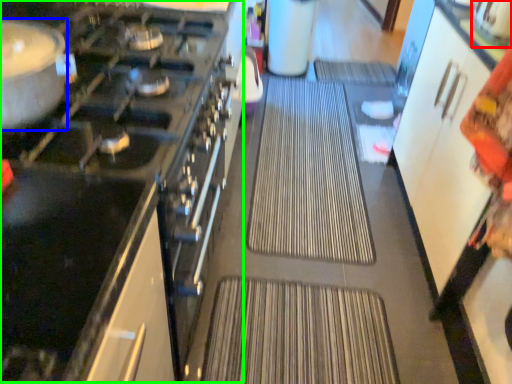
Question: Considering the real-world distances, which object is closest to appliance (highlighted by a red box)? kitchen appliance (highlighted by a blue box) or appliance (highlighted by a green box).

Choices:
 (A) kitchen appliance
 (B) appliance

Answer: (B)